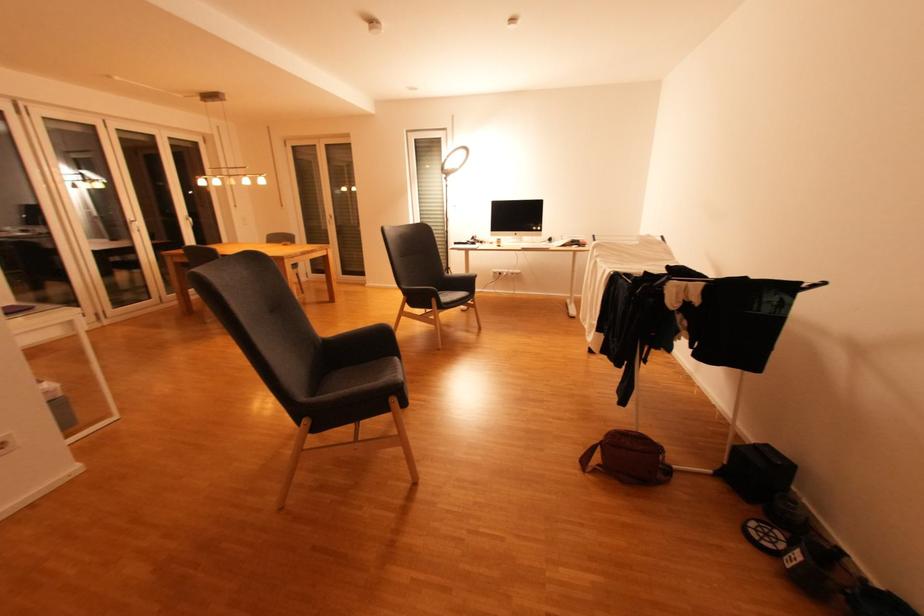
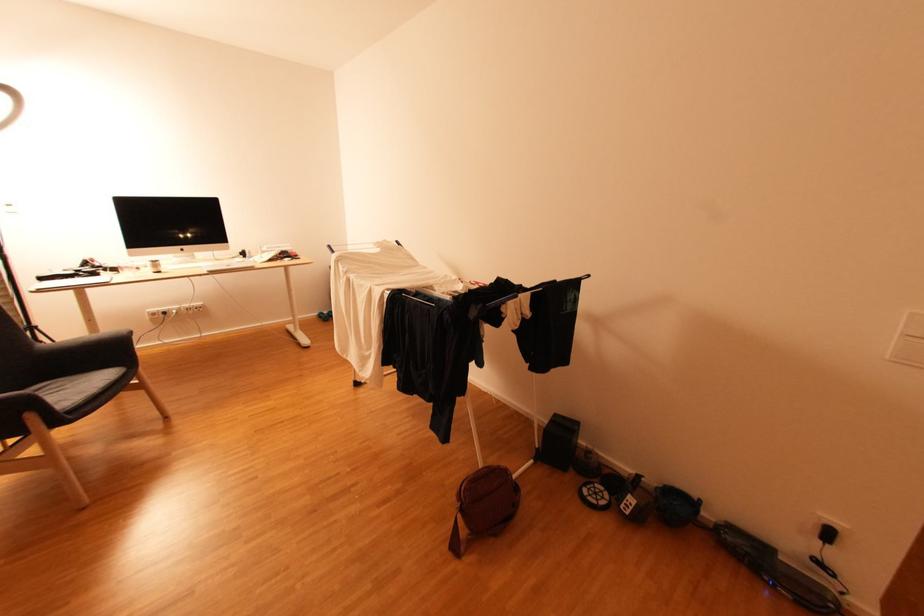
Question: Based on the continuous images, in which direction is the camera rotating? Reply with the corresponding letter.

Choices:
 (A) Left
 (B) Right
 (C) Up
 (D) Down

Answer: (B)